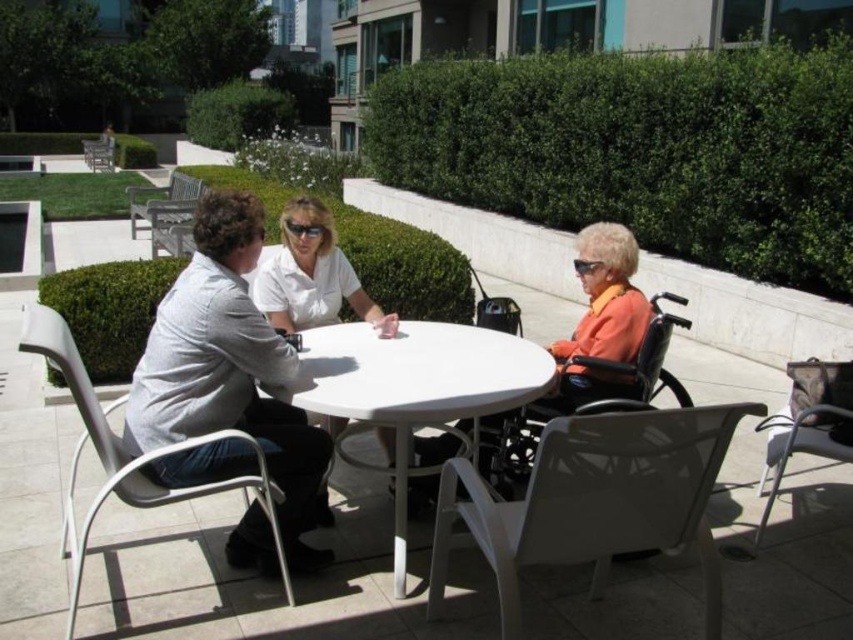
You are standing at the center of the patio and want to take a photo of the green leafy hedge at upper right. Which direction should you face to ensure it is in the frame?

The green leafy hedge at upper right is located at point 0.234 on the x axis and 0.753 on the y axis, so you should face towards the upper right direction to capture it in your photo.

You are a delivery person trying to navigate through the patio area. You need to deliver a package to the wooden bench at upper left. However, there is a matte black wheelchair at lower right in your path. Based on their heights, can you safely pass under the wheelchair without hitting your head?

The matte black wheelchair at lower right is much taller than the wooden bench at upper left. Since the wheelchair is taller, you might have to duck or adjust your path to avoid hitting your head as you pass under it.

You are a delivery person trying to place a small package on the table. The package requires a surface that is at least 60 cm in height. Can the white plastic table at center support the package based on its height compared to the white plastic chair at left?

The white plastic table at center is not as tall as the white plastic chair at left. Since the chair is taller than the table, if the chair meets the height requirement, the table might not. However, without knowing the chair height, we can only state that the table is shorter than the chair. Thus, it depends on the chair height whether the table meets the 60 cm requirement.